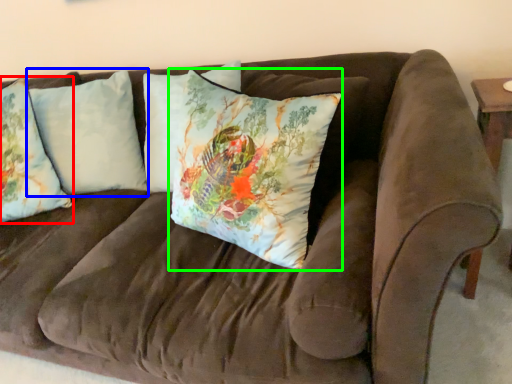
Question: Which is nearer to the pillow (highlighted by a red box)? pillow (highlighted by a blue box) or pillow (highlighted by a green box).

Choices:
 (A) pillow
 (B) pillow

Answer: (A)